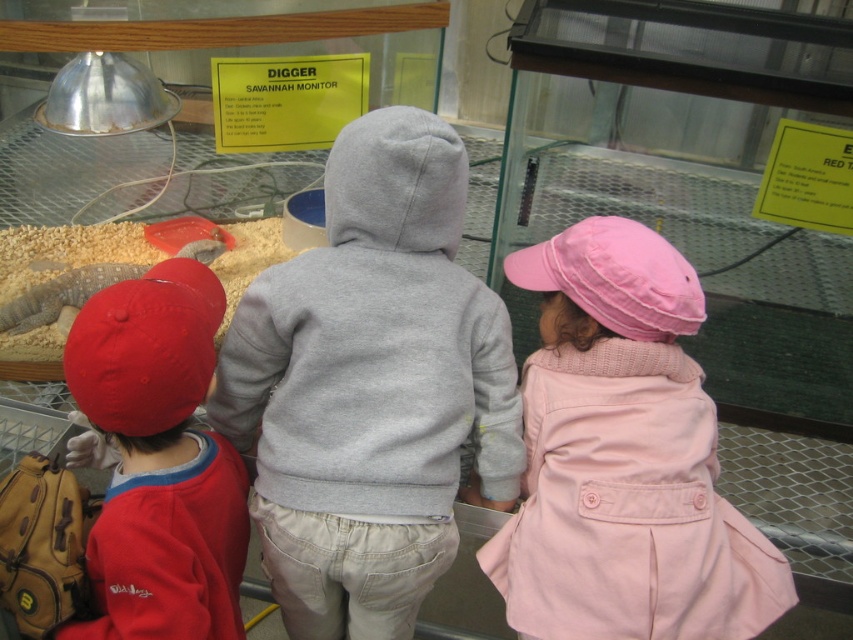
You are standing in front of the glass enclosure and see the children observing the Savannah monitor lizard. The children are wearing different colored clothing. Which child is wearing the gray fleece hoodie at center?

The child in the middle is wearing the gray fleece hoodie at center, as it is located at point (x=370, y=387) which places it centrally among the children.

You are a photographer standing at the entrance of the enclosure. You want to take a photo of the Savannah monitor lizard but need to ensure none of the children are in the frame. Given their positions, can you position yourself so that the pink cotton coat at center is not blocking the view?

The pink cotton coat at center is located at point (624, 458). By positioning yourself to avoid this coordinate, you can ensure the coat isn not blocking the lizard.